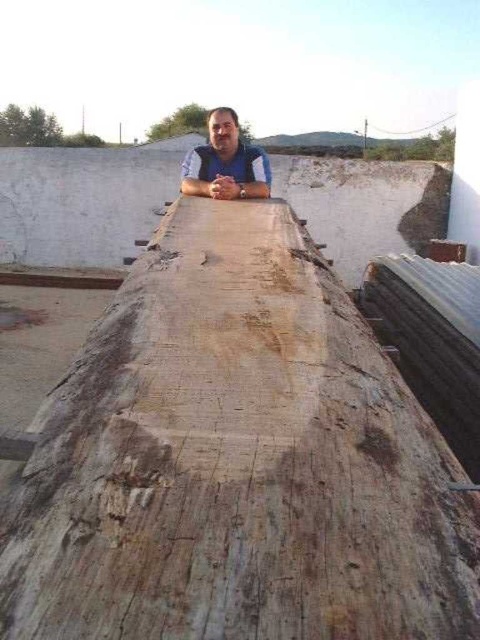
In the scene shown: You are standing at the point with coordinates point [212,188] and want to walk to the point with coordinates point [171,600]. Which direction should you move relative to the other point?

You should move forward because point [171,600] is in front of point [212,188].

You are an inspector at the construction site. You see the weathered wood at center and the blue matte shirt at center. Which object is taller?

The weathered wood at center is taller than the blue matte shirt at center.